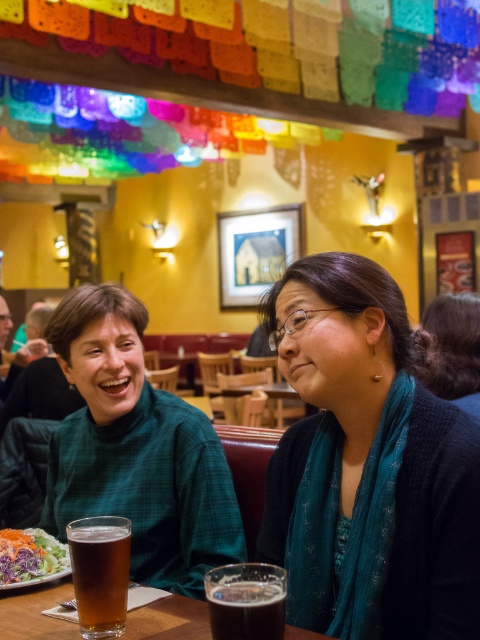
Question: Does teal scarf at center appear under translucent glass at lower left?

Choices:
 (A) no
 (B) yes

Answer: (A)

Question: Does translucent glass at lower left appear on the right side of fresh salad at lower left?

Choices:
 (A) yes
 (B) no

Answer: (A)

Question: Which point is farther from the camera taking this photo?

Choices:
 (A) (84, 380)
 (B) (404, 371)
 (C) (57, 547)

Answer: (A)

Question: Which object appears farthest from the camera in this image?

Choices:
 (A) teal scarf at center
 (B) translucent glass at lower left
 (C) fresh salad at lower left
 (D) dark brown liquid at lower center

Answer: (C)

Question: Does teal scarf at center have a greater width compared to fresh salad at lower left?

Choices:
 (A) no
 (B) yes

Answer: (B)

Question: Which of the following is the closest to the observer?

Choices:
 (A) (25, 554)
 (B) (84, 561)
 (C) (79, 328)

Answer: (B)